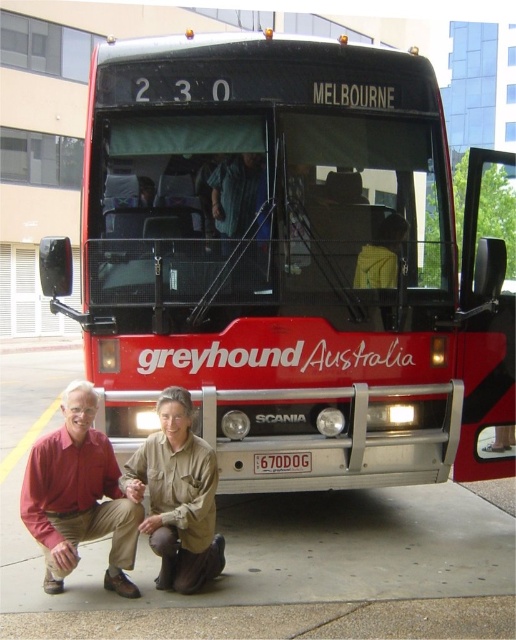
Question: Does metallic red bus at center lie in front of gray concrete pavement at lower center?

Choices:
 (A) no
 (B) yes

Answer: (A)

Question: Which is farther from the gray concrete pavement at lower center?

Choices:
 (A) metallic red bus at center
 (B) matte red shirt at lower left
 (C) brown leather jacket at lower center

Answer: (A)

Question: Can you confirm if metallic red bus at center is positioned to the left of brown leather jacket at lower center?

Choices:
 (A) yes
 (B) no

Answer: (B)

Question: Which of these objects is positioned closest to the metallic red bus at center?

Choices:
 (A) matte red shirt at lower left
 (B) gray concrete pavement at lower center

Answer: (A)

Question: Estimate the real-world distances between objects in this image. Which object is farther from the gray concrete pavement at lower center?

Choices:
 (A) matte red shirt at lower left
 (B) metallic red bus at center
 (C) brown leather jacket at lower center

Answer: (B)

Question: In this image, where is metallic red bus at center located relative to matte red shirt at lower left?

Choices:
 (A) below
 (B) above

Answer: (B)